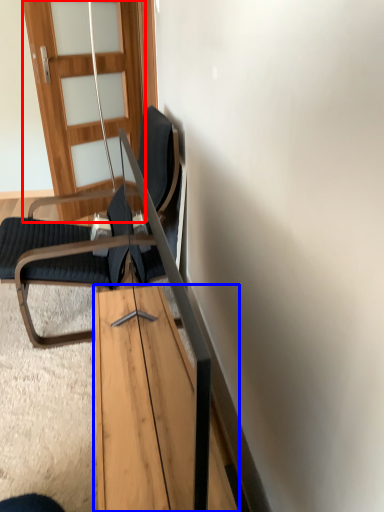
Question: Which object appears farthest to the camera in this image, door (highlighted by a red box) or table (highlighted by a blue box)?

Choices:
 (A) door
 (B) table

Answer: (A)